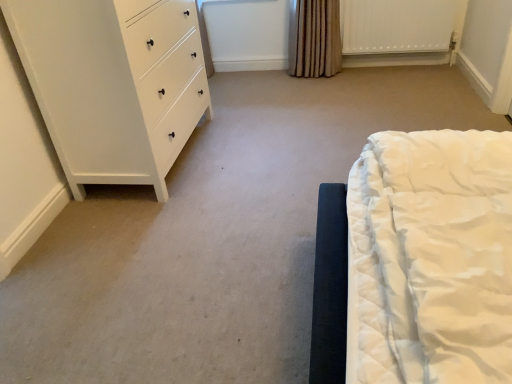
Question: Is white textured radiator at upper right taller or shorter than brown textured curtain at upper center?

Choices:
 (A) tall
 (B) short

Answer: (B)

Question: Is white textured radiator at upper right inside or outside of brown textured curtain at upper center?

Choices:
 (A) outside
 (B) inside

Answer: (A)

Question: Estimate the real-world distances between objects in this image. Which object is farther from the white textured radiator at upper right?

Choices:
 (A) white matte chest of drawers at left
 (B) brown textured curtain at upper center

Answer: (A)

Question: Based on their relative distances, which object is nearer to the brown textured curtain at upper center?

Choices:
 (A) white matte chest of drawers at left
 (B) white textured radiator at upper right

Answer: (B)